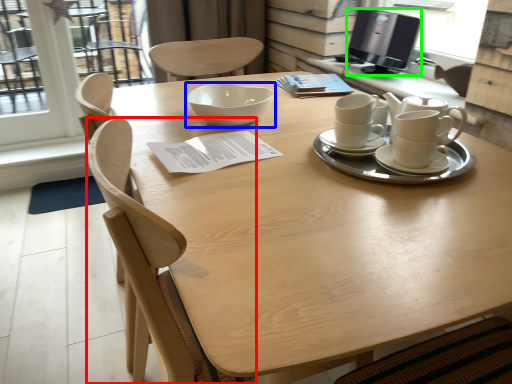
Question: Estimate the real-world distances between objects in this image. Which object is farther from chair (highlighted by a red box), bowl (highlighted by a blue box) or computer monitor (highlighted by a green box)?

Choices:
 (A) bowl
 (B) computer monitor

Answer: (B)